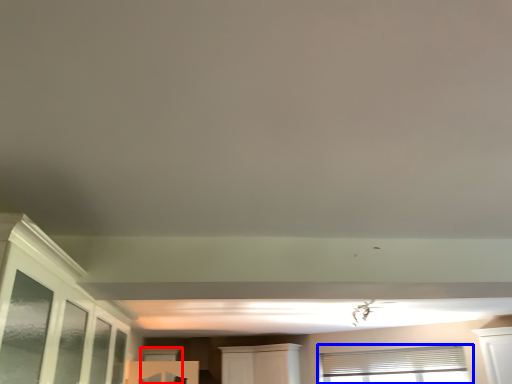
Question: Which object is further to the camera taking this photo, window (highlighted by a red box) or window (highlighted by a blue box)?

Choices:
 (A) window
 (B) window

Answer: (A)